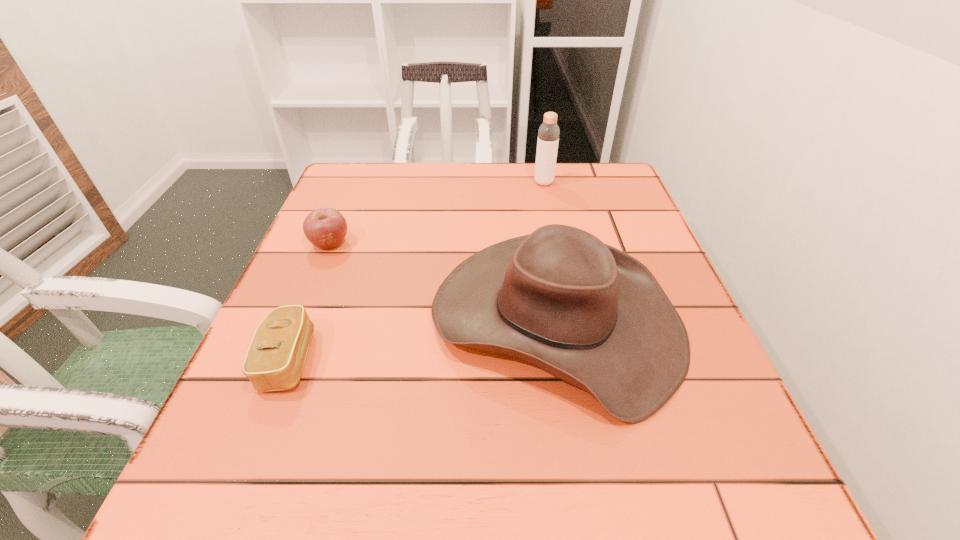
Where is `the tallest object`? the tallest object is located at coordinates (548, 135).

At what (x,y) coordinates should I click in order to perform the action: click on bottle. Please return your answer as a coordinate pair (x, y). Looking at the image, I should click on (548, 135).

I want to click on cowboy hat, so click(585, 312).

At what (x,y) coordinates should I click in order to perform the action: click on apple. Please return your answer as a coordinate pair (x, y). Looking at the image, I should click on (325, 228).

Locate an element on the screen. The image size is (960, 540). clutch bag is located at coordinates (275, 359).

You are a GUI agent. You are given a task and a screenshot of the screen. Output one action in this format:
    pyautogui.click(x=<x>, y=<y>)
    Task: Click on the vacant region located 0.230m on the left of the tallest object
    This screenshot has height=540, width=960.
    Given the screenshot: What is the action you would take?
    pyautogui.click(x=446, y=183)

The height and width of the screenshot is (540, 960). In order to click on free spot located 0.130m on the left of the third shortest object in this screenshot , I will do `click(360, 319)`.

Image resolution: width=960 pixels, height=540 pixels. I want to click on free space located 0.390m on the side of the apple with the unique marking, so 255,425.

The width and height of the screenshot is (960, 540). I want to click on vacant space situated on the zipper side of the clutch bag, so click(439, 360).

In order to click on object present at the far edge in this screenshot , I will do `click(548, 135)`.